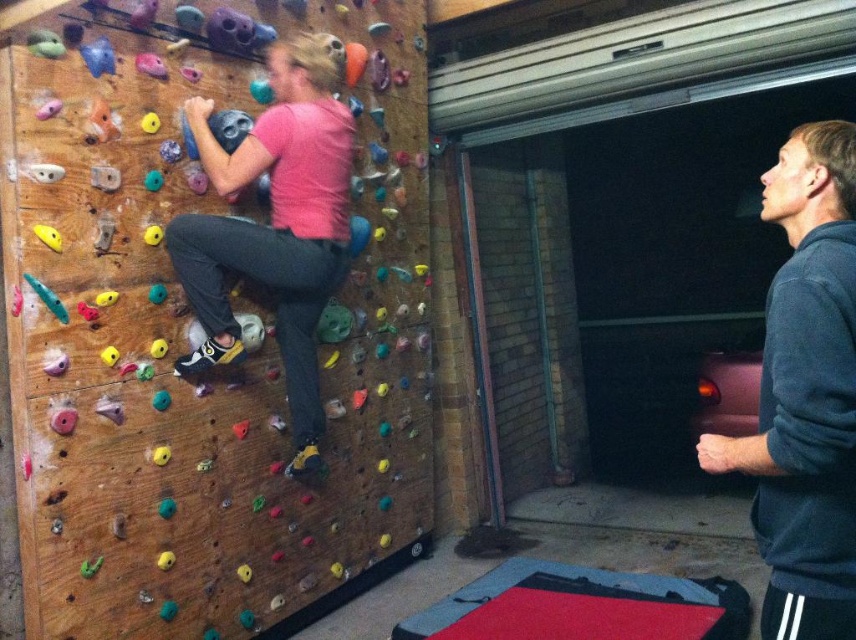
Is dark gray hoodie at right above pink matte shirt at center?

Actually, dark gray hoodie at right is below pink matte shirt at center.

Who is positioned more to the left, dark gray hoodie at right or pink matte shirt at center?

pink matte shirt at center is more to the left.

At what (x,y) coordinates should I click in order to perform the action: click on dark gray hoodie at right. Please return your answer as a coordinate pair (x, y). Looking at the image, I should click on (805, 394).

Where is `dark gray hoodie at right`? The width and height of the screenshot is (856, 640). dark gray hoodie at right is located at coordinates (805, 394).

Is wooden climbing wall at left wider than dark gray hoodie at right?

Correct, the width of wooden climbing wall at left exceeds that of dark gray hoodie at right.

Does wooden climbing wall at left appear on the left side of dark gray hoodie at right?

Yes, wooden climbing wall at left is to the left of dark gray hoodie at right.

Is point (22, 522) positioned before point (843, 310)?

No, (22, 522) is behind (843, 310).

You are a GUI agent. You are given a task and a screenshot of the screen. Output one action in this format:
    pyautogui.click(x=<x>, y=<y>)
    Task: Click on the wooden climbing wall at left
    This screenshot has height=640, width=856.
    Given the screenshot: What is the action you would take?
    pyautogui.click(x=201, y=328)

Is the position of wooden climbing wall at left less distant than that of pink matte shirt at center?

Yes, wooden climbing wall at left is closer to the viewer.

Consider the image. Does wooden climbing wall at left appear over pink matte shirt at center?

No.

What do you see at coordinates (201, 328) in the screenshot?
I see `wooden climbing wall at left` at bounding box center [201, 328].

This screenshot has height=640, width=856. In order to click on wooden climbing wall at left in this screenshot , I will do click(x=201, y=328).